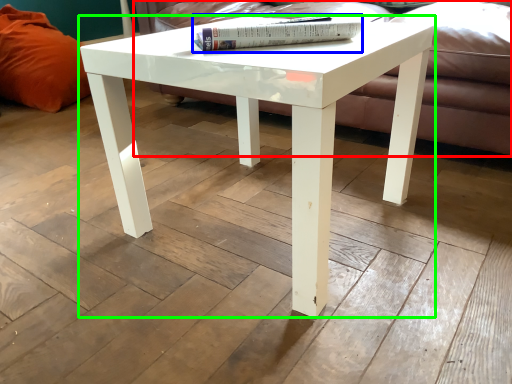
Question: Which is farther away from couch (highlighted by a red box)? book (highlighted by a blue box) or coffee table (highlighted by a green box)?

Choices:
 (A) book
 (B) coffee table

Answer: (B)